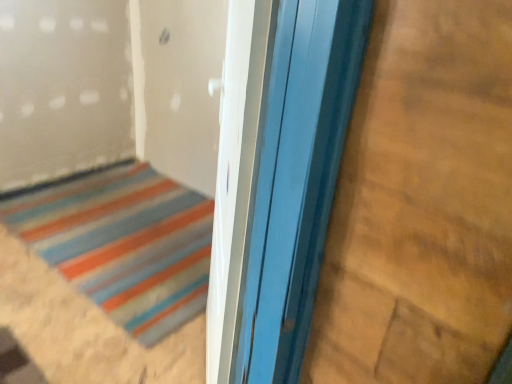
Question: Should I look upward or downward to see wooden door at center?

Choices:
 (A) down
 (B) up

Answer: (A)

Question: Considering the relative positions of wooden door at center and smooth wood plywood at right in the image provided, is wooden door at center behind smooth wood plywood at right?

Choices:
 (A) yes
 (B) no

Answer: (A)

Question: Does wooden door at center lie in front of smooth wood plywood at right?

Choices:
 (A) no
 (B) yes

Answer: (A)

Question: Does wooden door at center have a larger size compared to smooth wood plywood at right?

Choices:
 (A) yes
 (B) no

Answer: (A)

Question: Is wooden door at center not within smooth wood plywood at right?

Choices:
 (A) yes
 (B) no

Answer: (A)

Question: Is wooden door at center not near smooth wood plywood at right?

Choices:
 (A) yes
 (B) no

Answer: (A)

Question: Can you confirm if wooden door at center is positioned to the right of smooth wood plywood at right?

Choices:
 (A) yes
 (B) no

Answer: (B)

Question: Does smooth wood plywood at right have a greater width compared to wooden door at center?

Choices:
 (A) no
 (B) yes

Answer: (A)

Question: Is smooth wood plywood at right to the left of wooden door at center from the viewer's perspective?

Choices:
 (A) no
 (B) yes

Answer: (A)

Question: Is smooth wood plywood at right positioned in front of wooden door at center?

Choices:
 (A) yes
 (B) no

Answer: (A)

Question: Is smooth wood plywood at right positioned behind wooden door at center?

Choices:
 (A) yes
 (B) no

Answer: (B)

Question: Is wooden door at center a part of smooth wood plywood at right?

Choices:
 (A) yes
 (B) no

Answer: (B)

Question: Does smooth wood plywood at right have a lesser width compared to wooden door at center?

Choices:
 (A) no
 (B) yes

Answer: (B)

Question: Relative to wooden door at center, is smooth wood plywood at right in front or behind?

Choices:
 (A) behind
 (B) front

Answer: (B)